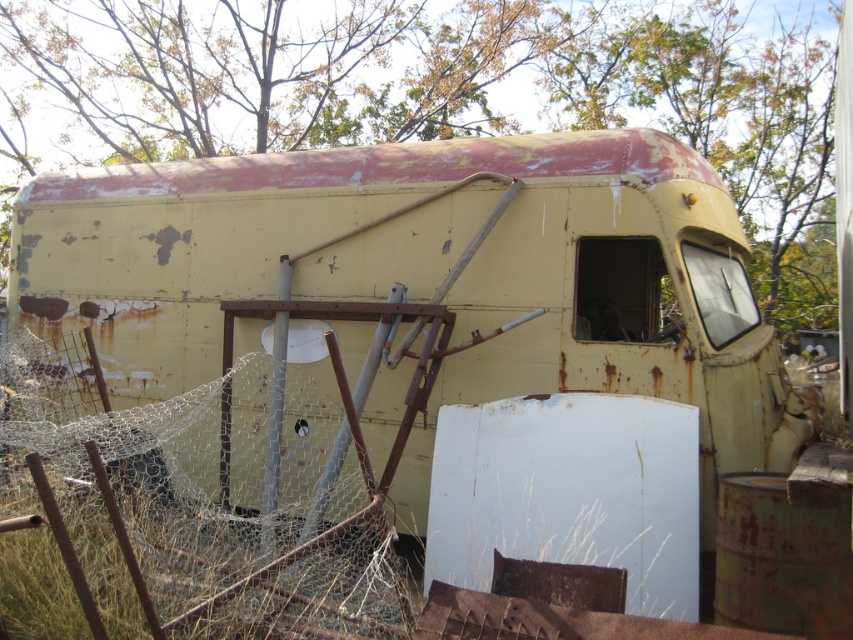
Does point (436, 515) lie behind point (140, 481)?

No.

Does rusty yellow trailer at center appear over rusty wire mesh at center?

Yes, rusty yellow trailer at center is above rusty wire mesh at center.

Identify the location of rusty yellow trailer at center. (456, 328).

Find the location of a particular element. rusty yellow trailer at center is located at coordinates (456, 328).